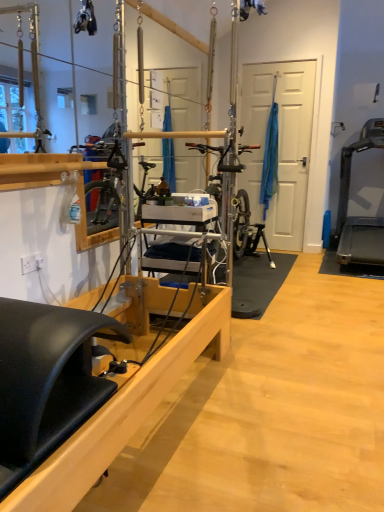
Question: Should I look upward or downward to see black plastic treadmill at right?

Choices:
 (A) up
 (B) down

Answer: (A)

Question: Is black plastic treadmill at right not inside wooden pilates reformer at center?

Choices:
 (A) no
 (B) yes

Answer: (B)

Question: Does black plastic treadmill at right appear on the left side of wooden pilates reformer at center?

Choices:
 (A) no
 (B) yes

Answer: (A)

Question: Does black plastic treadmill at right have a greater height compared to wooden pilates reformer at center?

Choices:
 (A) yes
 (B) no

Answer: (A)

Question: Considering the relative sizes of black plastic treadmill at right and wooden pilates reformer at center in the image provided, is black plastic treadmill at right bigger than wooden pilates reformer at center?

Choices:
 (A) no
 (B) yes

Answer: (B)

Question: Is there a large distance between black plastic treadmill at right and wooden pilates reformer at center?

Choices:
 (A) yes
 (B) no

Answer: (A)

Question: Considering the relative positions of black plastic treadmill at right and wooden pilates reformer at center in the image provided, is black plastic treadmill at right in front of wooden pilates reformer at center?

Choices:
 (A) yes
 (B) no

Answer: (B)

Question: Are wooden pilates reformer at center and black plastic treadmill at right located far from each other?

Choices:
 (A) no
 (B) yes

Answer: (B)

Question: Can you confirm if wooden pilates reformer at center is taller than black plastic treadmill at right?

Choices:
 (A) yes
 (B) no

Answer: (B)

Question: Is wooden pilates reformer at center located outside black plastic treadmill at right?

Choices:
 (A) yes
 (B) no

Answer: (A)

Question: Is wooden pilates reformer at center at the right side of black plastic treadmill at right?

Choices:
 (A) no
 (B) yes

Answer: (A)

Question: Considering the relative sizes of wooden pilates reformer at center and black plastic treadmill at right in the image provided, is wooden pilates reformer at center wider than black plastic treadmill at right?

Choices:
 (A) yes
 (B) no

Answer: (A)

Question: Considering the relative sizes of wooden pilates reformer at center and black plastic treadmill at right in the image provided, is wooden pilates reformer at center bigger than black plastic treadmill at right?

Choices:
 (A) no
 (B) yes

Answer: (A)

Question: From a real-world perspective, is wooden pilates reformer at center physically located above or below black plastic treadmill at right?

Choices:
 (A) above
 (B) below

Answer: (B)